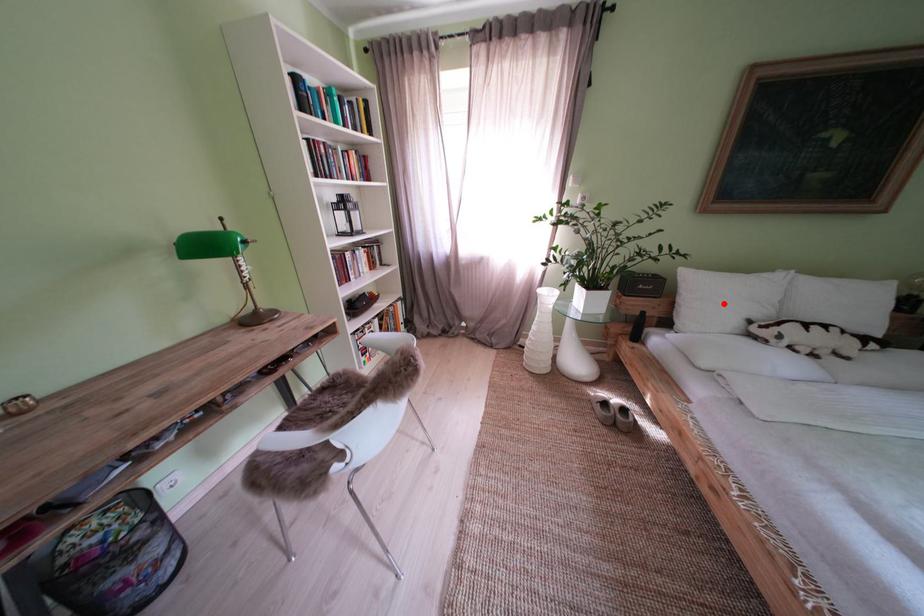
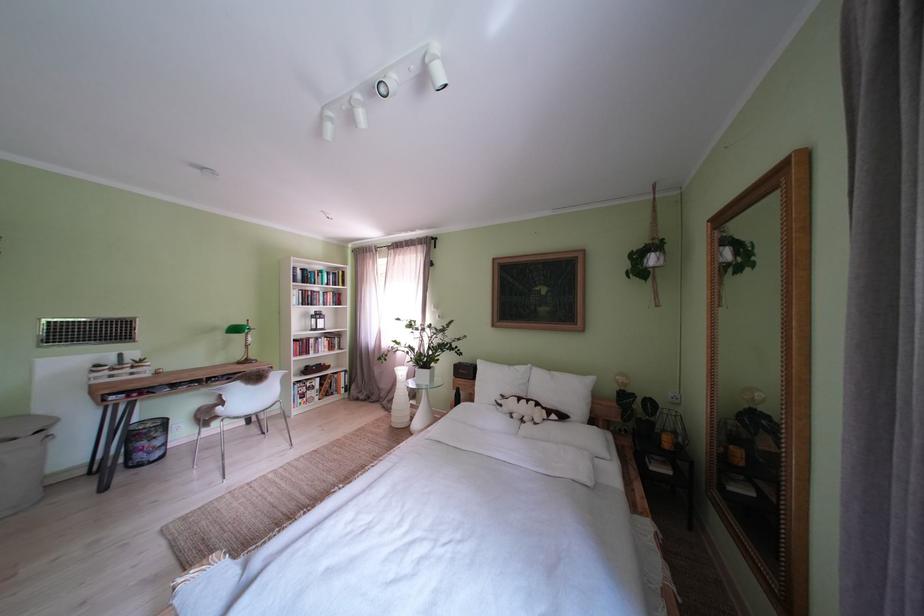
Question: I am providing you with two images of the same scene from different viewpoints. A red point is shown in image1. For the corresponding object point in image2, is it positioned nearer or farther from the camera?

Choices:
 (A) Nearer
 (B) Farther

Answer: (B)